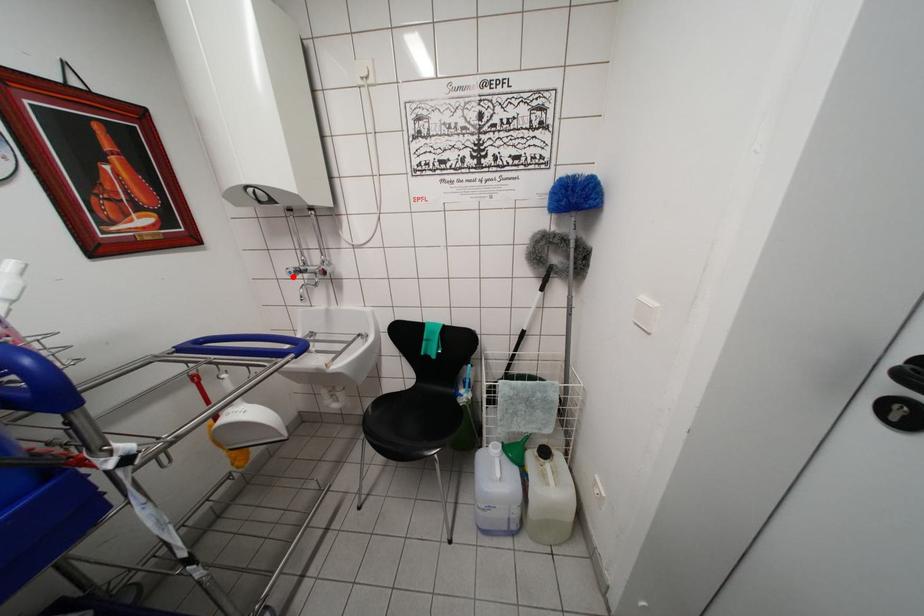
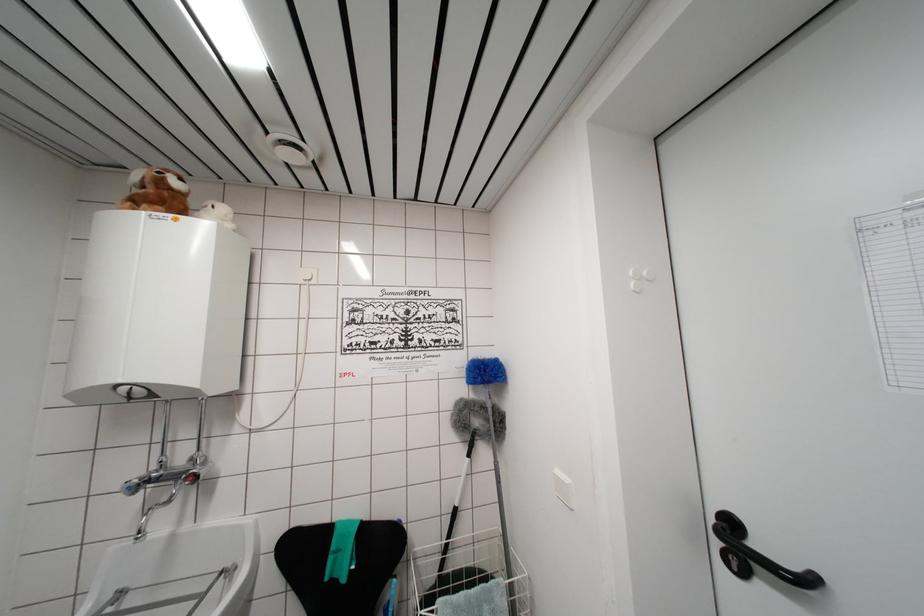
In the second image, find the point that corresponds to the highlighted location in the first image.

(132, 493)